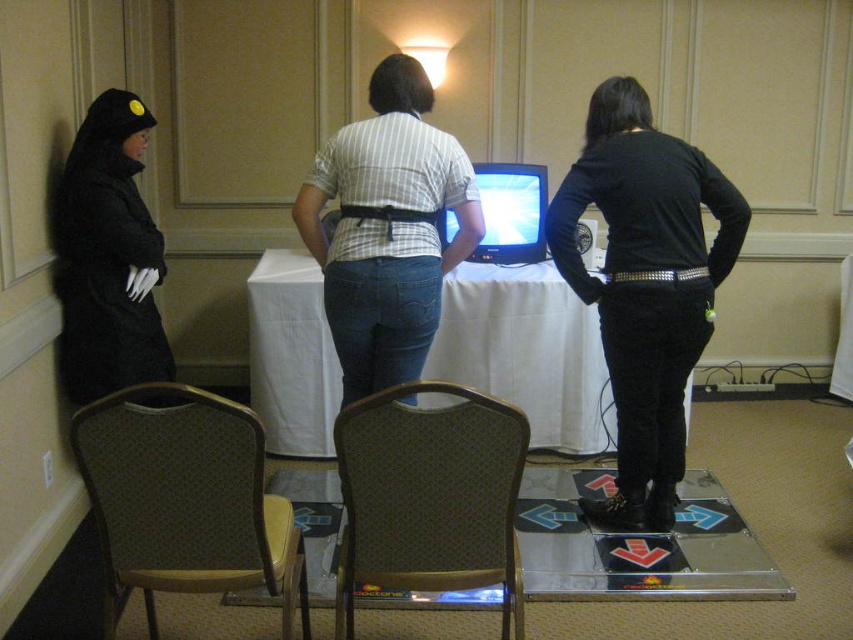
You are organizing a tech event and need to place a new promotional banner between the black matte coat at left and the matte plastic television at center. Based on their positions, where should you place the banner so it is centered between them?

The banner should be placed between the black matte coat at left and the matte plastic television at center, centered between them since the black matte coat at left is positioned on the left side of the matte plastic television at center.

Based on the photo, you are standing at the point marked by the coordinates point [428,497]. Which object is directly in front of you?

The brown fabric chair at lower center is directly in front of you at point [428,497].

You are a delivery person who needs to place a 1.2 meter long package between the white cloth table at center and the brown fabric chair at lower center. Is there enough space to fit the package horizontally between them?

The distance between the white cloth table at center and the brown fabric chair at lower center is 1.50 meters. Since the package is 1.2 meters long, there is sufficient space to place it horizontally between them.